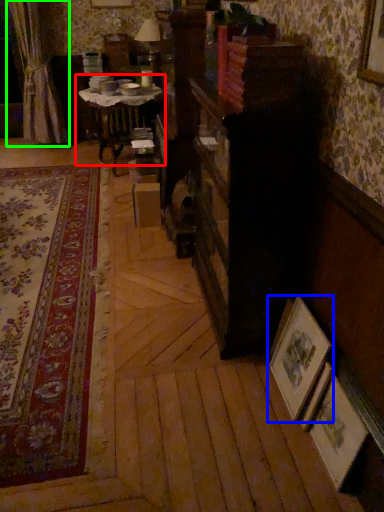
Question: Estimate the real-world distances between objects in this image. Which object is closer to table (highlighted by a red box), picture frame (highlighted by a blue box) or curtain (highlighted by a green box)?

Choices:
 (A) picture frame
 (B) curtain

Answer: (B)